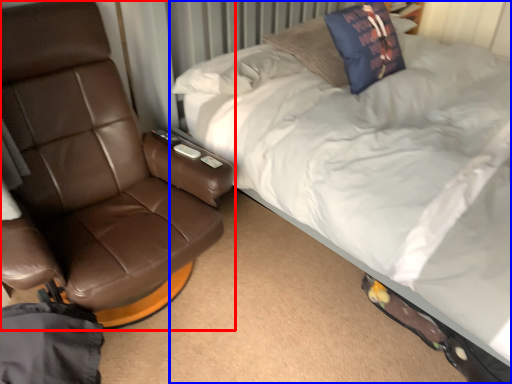
Question: Which object appears farthest to the camera in this image, chair (highlighted by a red box) or bed (highlighted by a blue box)?

Choices:
 (A) chair
 (B) bed

Answer: (A)